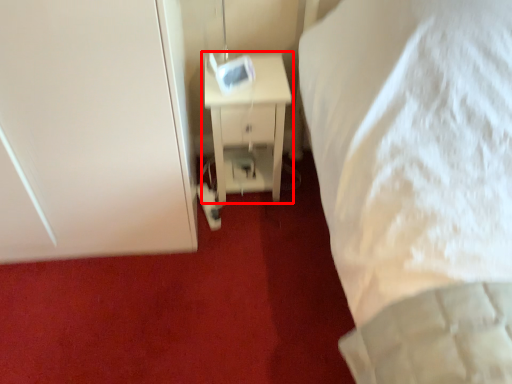
Question: From the image's perspective, where is nightstand (annotated by the red box) located in relation to door in the image?

Choices:
 (A) above
 (B) below

Answer: (B)